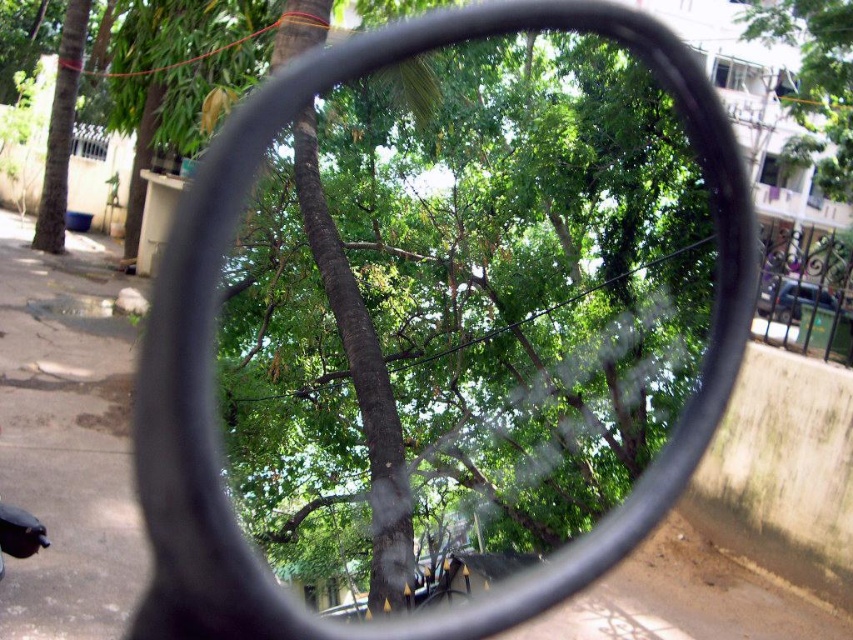
You are a delivery robot with a height of 1.5 meters. You need to pass through the space between the black rubber mirror at center and the camera. Can you fit through this space vertically?

The distance between the black rubber mirror at center and the camera is 3.70 meters, which is taller than the robot height of 1.5 meters. Therefore, the robot can fit through the space vertically.

You are looking at the circular mirror and notice two points marked in the reflection. The first point is at coordinates point (224, 170) and the second is at point (79, 45). Which of these points is nearer to your eyes as you observe them through the mirror?

Point (224, 170) is closer to the camera than point (79, 45), so the first point is nearer to your eyes as you observe them through the mirror.

From the picture: You are a driver looking at the circular mirror attached to your car. You notice two green leafy trees reflected in the mirror. Which tree, the green leafy tree at upper right or the green leafy tree at left, appears larger in the reflection?

The green leafy tree at upper right appears larger in the reflection than the green leafy tree at left because it is bigger according to the mirror.